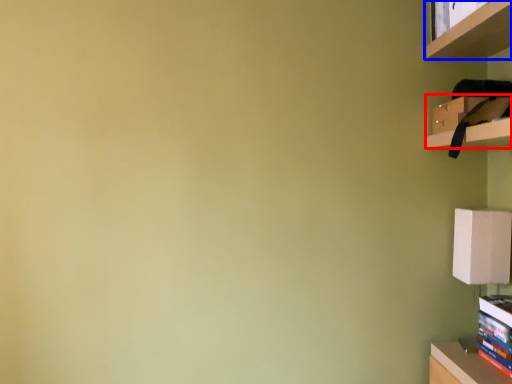
Question: Which object is further to the camera taking this photo, cabinet (highlighted by a red box) or shelf (highlighted by a blue box)?

Choices:
 (A) cabinet
 (B) shelf

Answer: (A)